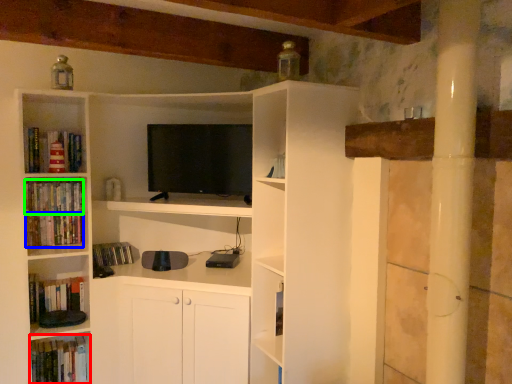
Question: Considering the real-world distances, which object is farthest from book (highlighted by a red box)? book (highlighted by a blue box) or book (highlighted by a green box)?

Choices:
 (A) book
 (B) book

Answer: (B)